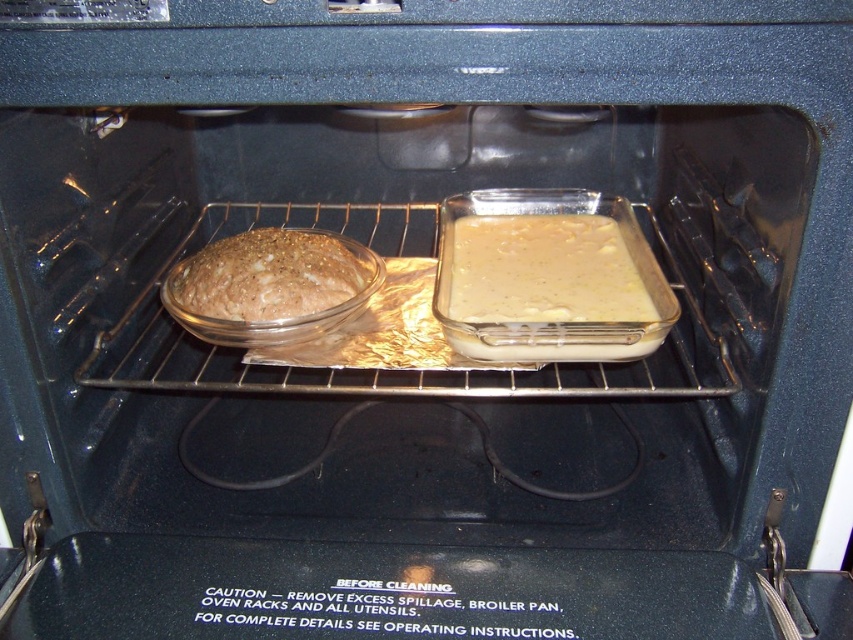
Question: Can you confirm if yellow matte cake at center is thinner than brown matte bread at center?

Choices:
 (A) no
 (B) yes

Answer: (A)

Question: Where is yellow matte cake at center located in relation to brown matte bread at center in the image?

Choices:
 (A) below
 (B) above

Answer: (B)

Question: Considering the relative positions of yellow matte cake at center and brown matte bread at center in the image provided, where is yellow matte cake at center located with respect to brown matte bread at center?

Choices:
 (A) left
 (B) right

Answer: (B)

Question: Among these objects, which one is nearest to the camera?

Choices:
 (A) brown matte bread at center
 (B) yellow matte cake at center

Answer: (B)